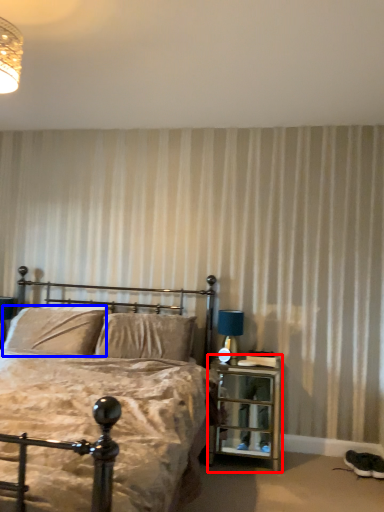
Question: Which of the following is the closest to the observer, nightstand (highlighted by a red box) or pillow (highlighted by a blue box)?

Choices:
 (A) nightstand
 (B) pillow

Answer: (A)